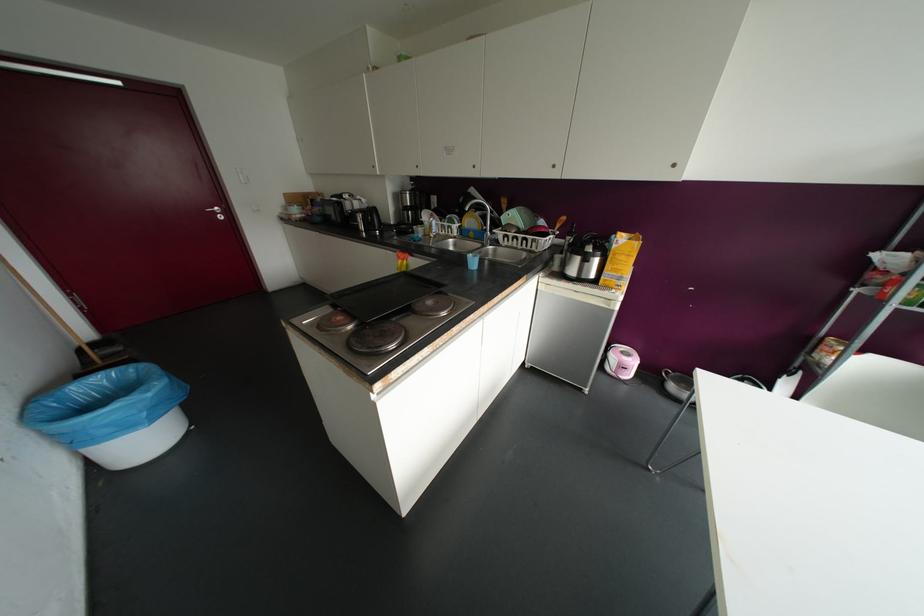
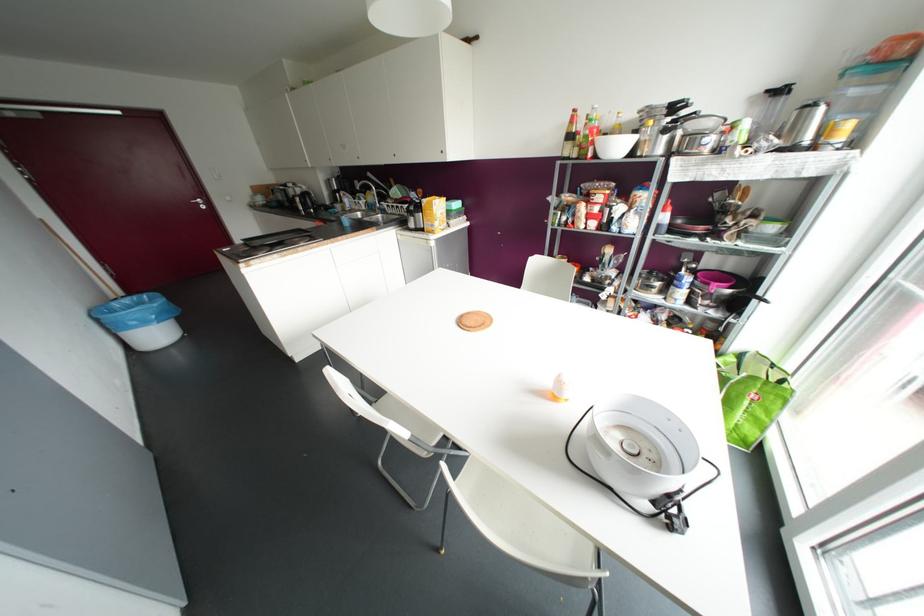
Locate, in the second image, the point that corresponds to (x=220, y=217) in the first image.

(202, 207)